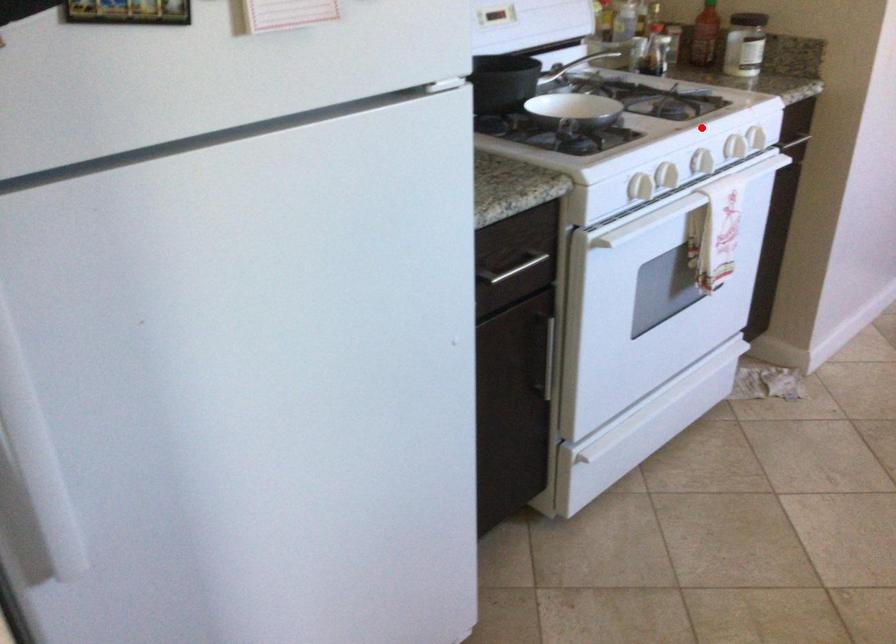
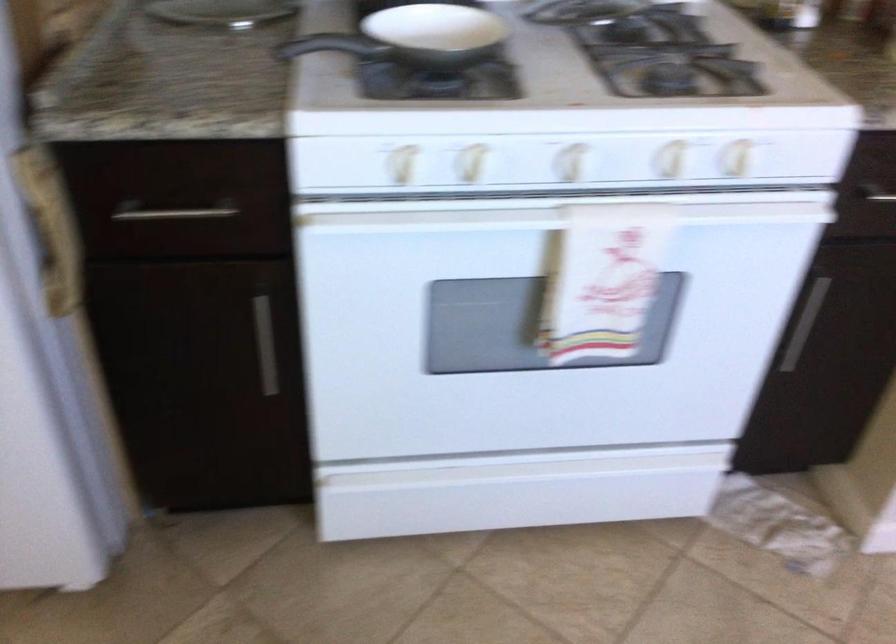
In the second image, find the point that corresponds to the highlighted location in the first image.

(573, 162)